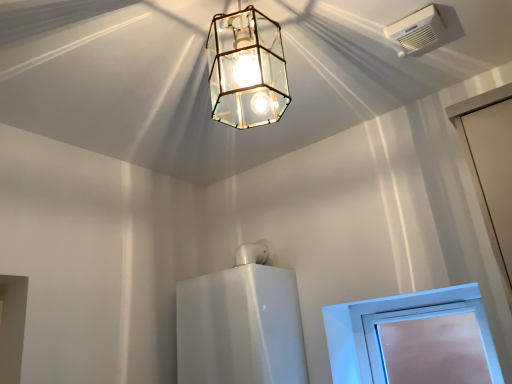
Question: Can you confirm if white plastic window at lower right is bigger than clear glass lantern at upper center?

Choices:
 (A) yes
 (B) no

Answer: (B)

Question: Can you confirm if white plastic window at lower right is taller than clear glass lantern at upper center?

Choices:
 (A) yes
 (B) no

Answer: (B)

Question: From the image's perspective, is white plastic window at lower right below clear glass lantern at upper center?

Choices:
 (A) no
 (B) yes

Answer: (B)

Question: From a real-world perspective, is white plastic window at lower right physically above clear glass lantern at upper center?

Choices:
 (A) no
 (B) yes

Answer: (A)

Question: Considering the relative sizes of white plastic window at lower right and clear glass lantern at upper center in the image provided, is white plastic window at lower right thinner than clear glass lantern at upper center?

Choices:
 (A) yes
 (B) no

Answer: (A)

Question: Choose the correct answer: Is clear glass lantern at upper center inside white plastic air conditioning unit at upper right or outside it?

Choices:
 (A) inside
 (B) outside

Answer: (B)

Question: Considering the positions of point (263, 89) and point (403, 43), is point (263, 89) closer or farther from the camera than point (403, 43)?

Choices:
 (A) farther
 (B) closer

Answer: (A)

Question: Is clear glass lantern at upper center taller or shorter than white plastic air conditioning unit at upper right?

Choices:
 (A) tall
 (B) short

Answer: (A)

Question: Is clear glass lantern at upper center in front of or behind white plastic air conditioning unit at upper right in the image?

Choices:
 (A) front
 (B) behind

Answer: (A)

Question: Considering their positions, is white plastic air conditioning unit at upper right located in front of or behind clear glass lantern at upper center?

Choices:
 (A) behind
 (B) front

Answer: (A)

Question: Does point (428, 11) appear closer or farther from the camera than point (240, 107)?

Choices:
 (A) farther
 (B) closer

Answer: (B)

Question: Looking at the image, does white plastic air conditioning unit at upper right seem bigger or smaller compared to clear glass lantern at upper center?

Choices:
 (A) big
 (B) small

Answer: (B)

Question: From a real-world perspective, is white plastic air conditioning unit at upper right above or below clear glass lantern at upper center?

Choices:
 (A) below
 (B) above

Answer: (B)

Question: In terms of size, does white plastic window at lower right appear bigger or smaller than clear glass lantern at upper center?

Choices:
 (A) big
 (B) small

Answer: (B)

Question: Choose the correct answer: Is white plastic window at lower right inside clear glass lantern at upper center or outside it?

Choices:
 (A) outside
 (B) inside

Answer: (A)